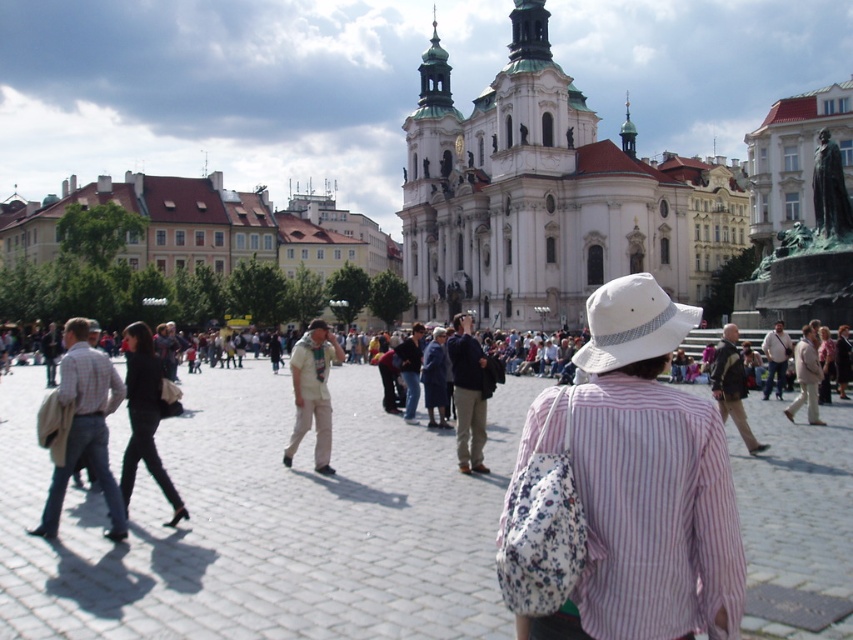
At what (x,y) coordinates should I click in order to perform the action: click on white cotton hat at center. Please return your answer as a coordinate pair (x, y). The height and width of the screenshot is (640, 853). Looking at the image, I should click on (640, 481).

Measure the distance between point (654,625) and camera.

They are 111.87 feet apart.

Locate an element on the screen. white cotton hat at center is located at coordinates (640, 481).

Does light brown leather jacket at left appear under dark gray fabric jacket at left?

Yes.

Find the location of a particular element. light brown leather jacket at left is located at coordinates (85, 426).

Locate an element on the screen. Image resolution: width=853 pixels, height=640 pixels. light brown leather jacket at left is located at coordinates (85, 426).

Does white marble church at center have a greater height compared to white cotton hat at center?

Correct, white marble church at center is much taller as white cotton hat at center.

Between point (614, 224) and point (643, 544), which one is positioned in front?

Point (643, 544)

You are a GUI agent. You are given a task and a screenshot of the screen. Output one action in this format:
    pyautogui.click(x=<x>, y=<y>)
    Task: Click on the white marble church at center
    The image size is (853, 640).
    Given the screenshot: What is the action you would take?
    pyautogui.click(x=547, y=196)